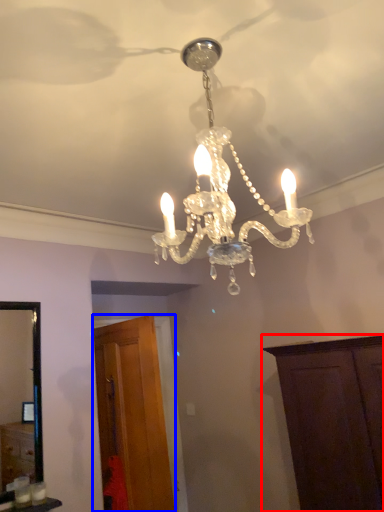
Question: Among these objects, which one is farthest to the camera, cabinetry (highlighted by a red box) or cabinetry (highlighted by a blue box)?

Choices:
 (A) cabinetry
 (B) cabinetry

Answer: (B)